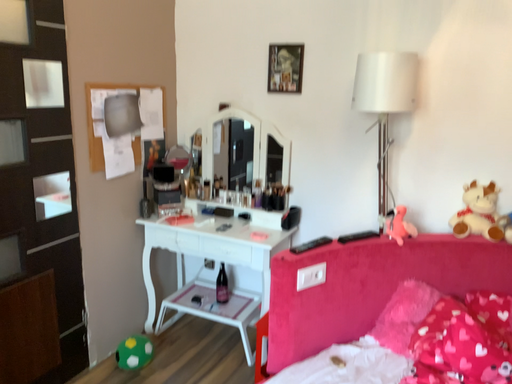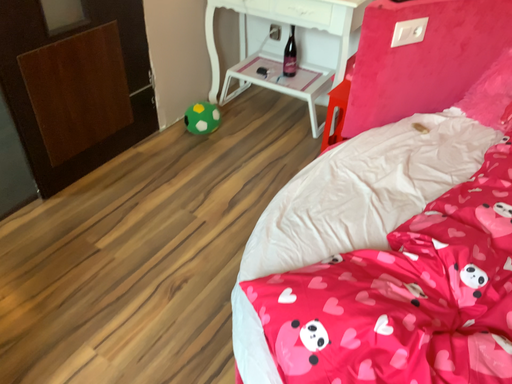
Question: Which way did the camera rotate in the video?

Choices:
 (A) rotated upward
 (B) rotated downward

Answer: (B)